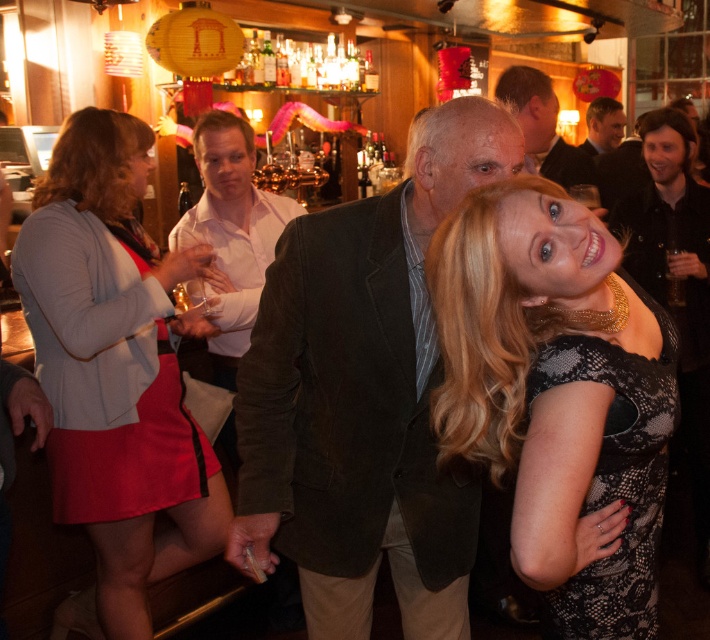
Looking at this image, you are a bartender at the bar. A customer wearing a dark brown corduroy blazer at center is standing 4.53 feet away from you. Can you serve them a drink without leaving your current position at the bar?

The customer wearing the dark brown corduroy blazer at center is 4.53 feet away. Since this distance is within typical serving range at a bar, you can likely serve them without needing to leave your position.

You are a photographer at this event and want to capture both the black lace dress at center and the matte brown jacket at center in a single frame. Given their sizes, which object would you need to position closer to the camera to ensure both fit within the shot?

The black lace dress at center has a lesser width compared to the matte brown jacket at center. To ensure both fit within the shot, you should position the matte brown jacket at center closer to the camera since it is wider and requires more space in the frame.

You are a fashion stylist who needs to recommend a coat to a client. The client prefers a smaller, more compact option. Looking at the dark brown corduroy blazer at center and the smooth brown leather jacket at upper right in the image, which one would you suggest?

The smooth brown leather jacket at upper right is smaller in size than the dark brown corduroy blazer at center, so the smooth brown leather jacket at upper right would be the better recommendation for a more compact option.